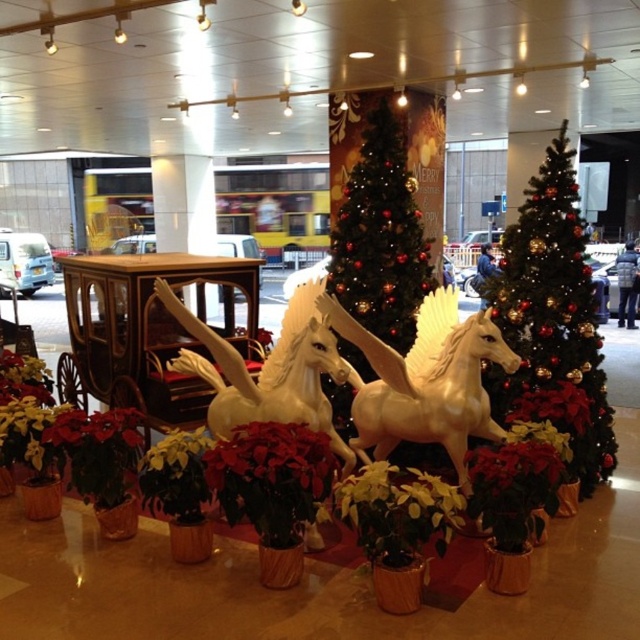
From the picture: Who is lower down, shiny gold christmas tree at center or white glossy horse at center?

white glossy horse at center is lower down.

Does shiny gold christmas tree at center have a larger size compared to white glossy horse at center?

Incorrect, shiny gold christmas tree at center is not larger than white glossy horse at center.

I want to click on shiny gold christmas tree at center, so click(x=376, y=218).

Find the location of a particular element. This screenshot has height=640, width=640. shiny gold christmas tree at center is located at coordinates (376, 218).

Is gold glossy horse at center above red velvet poinsettia at center?

Correct, gold glossy horse at center is located above red velvet poinsettia at center.

Who is positioned more to the right, gold glossy horse at center or red velvet poinsettia at center?

Positioned to the right is gold glossy horse at center.

At what (x,y) coordinates should I click in order to perform the action: click on gold glossy horse at center. Please return your answer as a coordinate pair (x, y). The height and width of the screenshot is (640, 640). Looking at the image, I should click on (424, 380).

Based on the photo, can you confirm if gold glossy horse at center is smaller than wooden coach at center?

Incorrect, gold glossy horse at center is not smaller in size than wooden coach at center.

Who is positioned more to the left, gold glossy horse at center or wooden coach at center?

Positioned to the left is gold glossy horse at center.

The width and height of the screenshot is (640, 640). I want to click on gold glossy horse at center, so click(424, 380).

This screenshot has width=640, height=640. I want to click on gold glossy horse at center, so click(x=424, y=380).